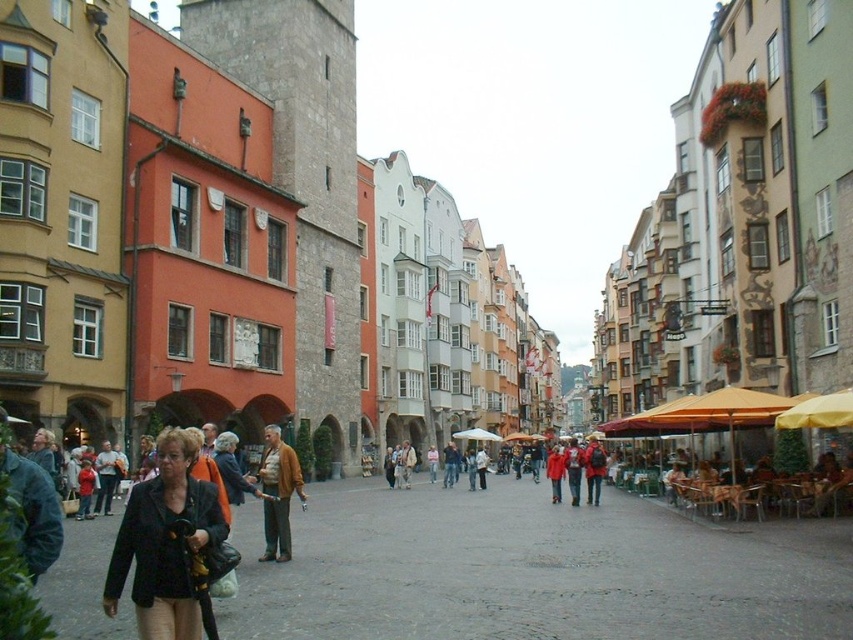
Which of these two, black fabric jacket at lower left or red backpack at center, stands shorter?

Standing shorter between the two is black fabric jacket at lower left.

Is black fabric jacket at lower left wider than red backpack at center?

Incorrect, black fabric jacket at lower left's width does not surpass red backpack at center's.

Does point (160, 435) lie in front of point (596, 468)?

Yes.

The height and width of the screenshot is (640, 853). I want to click on black fabric jacket at lower left, so click(167, 545).

Which of these two, black fabric jacket at lower left or brown leather jacket at lower left, stands shorter?

Standing shorter between the two is brown leather jacket at lower left.

Describe the element at coordinates (167, 545) in the screenshot. I see `black fabric jacket at lower left` at that location.

Between point (202, 577) and point (264, 500), which one is positioned in front?

Positioned in front is point (202, 577).

This screenshot has width=853, height=640. In order to click on black fabric jacket at lower left in this screenshot , I will do `click(167, 545)`.

Is brown leather jacket at lower left closer to camera compared to red backpack at center?

Yes.

Is brown leather jacket at lower left wider than red backpack at center?

No, brown leather jacket at lower left is not wider than red backpack at center.

Is point (268, 460) farther from viewer compared to point (602, 454)?

No, (268, 460) is closer to viewer.

The width and height of the screenshot is (853, 640). Identify the location of brown leather jacket at lower left. (277, 493).